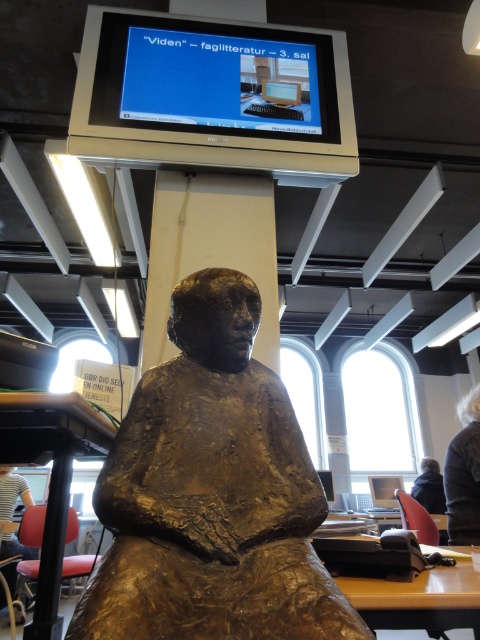
You are a student who needs to place a heavy textbook on a stable surface. You have two options in the scene, the black matte table at lower left and the wooden table at lower center. Which table is higher and thus more accessible for placing the book without bending down?

The black matte table at lower left is above the wooden table at lower center, so it is higher and more accessible for placing the book without bending down.

You are a visitor in the library and want to take a photo of the bronze statue of a seated figure. You notice two points marked on the floor at coordinates point (249, 577) and point (404, 550). Which point should you stand at to ensure the statue is fully visible without any obstruction?

You should stand at point (249, 577) because it is in front of point (404, 550), providing a clearer and unobstructed view of the bronze statue of a seated figure.

You are organizing a small exhibition in the library and need to place a 1.2 meter wide decorative panel between the bronze statue at center and the wooden table at lower center. Can the panel fit between them based on their sizes?

The bronze statue at center is bigger than wooden table at lower center. Since the panel is 1.2 meters wide, it is unclear if there is enough space between them without knowing the exact distance between the two objects.